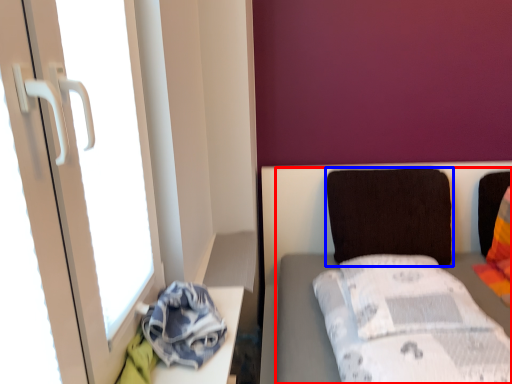
Question: Which of the following is the closest to the observer, furniture (highlighted by a red box) or pillow (highlighted by a blue box)?

Choices:
 (A) furniture
 (B) pillow

Answer: (A)